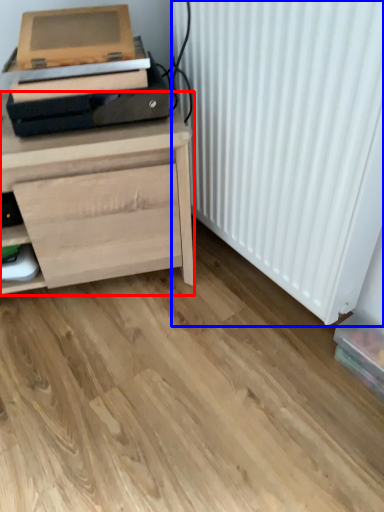
Question: Which point is closer to the camera, chest of drawers (highlighted by a red box) or radiator (highlighted by a blue box)?

Choices:
 (A) chest of drawers
 (B) radiator

Answer: (B)